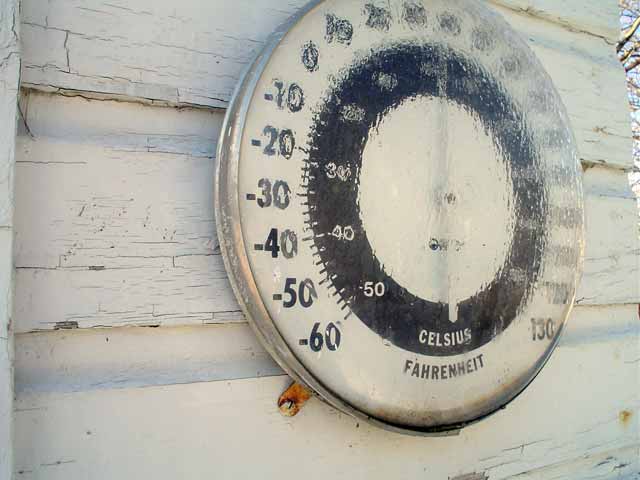
Find the location of a particular element. thermometer is located at coordinates (260, 190).